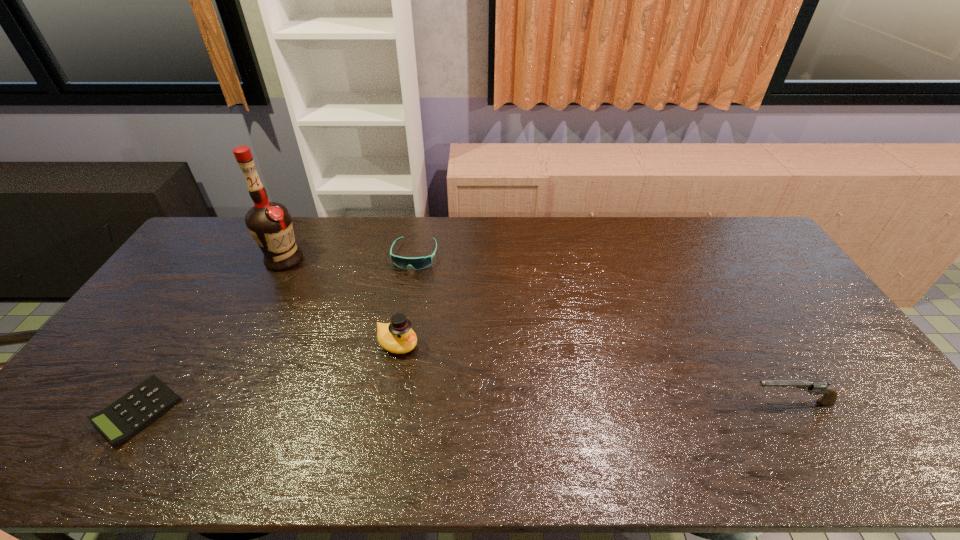
This screenshot has width=960, height=540. Identify the location of vacant space located 0.190m on the front-facing side of the sunglasses. (399, 313).

Image resolution: width=960 pixels, height=540 pixels. What are the coordinates of `vacant space located on the front-facing side of the sunglasses` in the screenshot? It's located at (396, 325).

I want to click on liquor at the far edge, so click(270, 224).

Identify the location of sunglasses that is at the far edge. This screenshot has height=540, width=960. (417, 263).

I want to click on calculator positioned at the near edge, so click(x=124, y=418).

Find the location of a particular element. The width and height of the screenshot is (960, 540). gun that is at the near edge is located at coordinates (829, 396).

Find the location of a particular element. This screenshot has width=960, height=540. object at the left edge is located at coordinates click(x=124, y=418).

Locate an element on the screen. object at the right edge is located at coordinates (829, 396).

Locate an element on the screen. Image resolution: width=960 pixels, height=540 pixels. object at the near left corner is located at coordinates (124, 418).

The width and height of the screenshot is (960, 540). I want to click on object that is at the near right corner, so point(829,396).